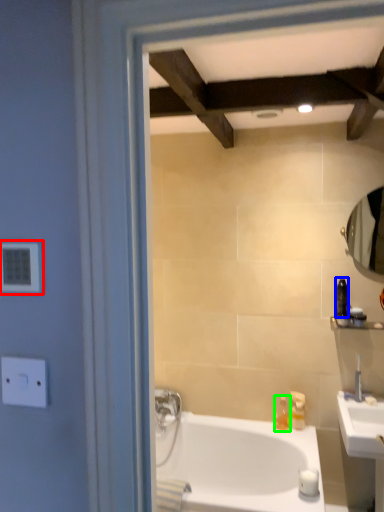
Question: Based on their relative distances, which object is nearer to electric outlet (highlighted by a red box)? Choose from toiletry (highlighted by a blue box) and soap dispenser (highlighted by a green box).

Choices:
 (A) toiletry
 (B) soap dispenser

Answer: (A)